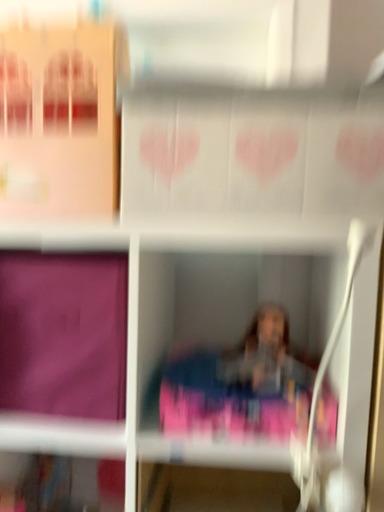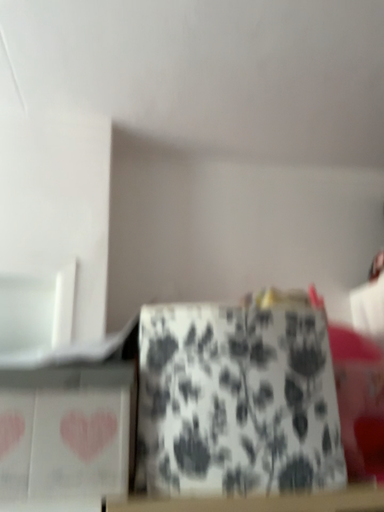
Question: Which way did the camera rotate in the video?

Choices:
 (A) rotated upward
 (B) rotated downward

Answer: (A)